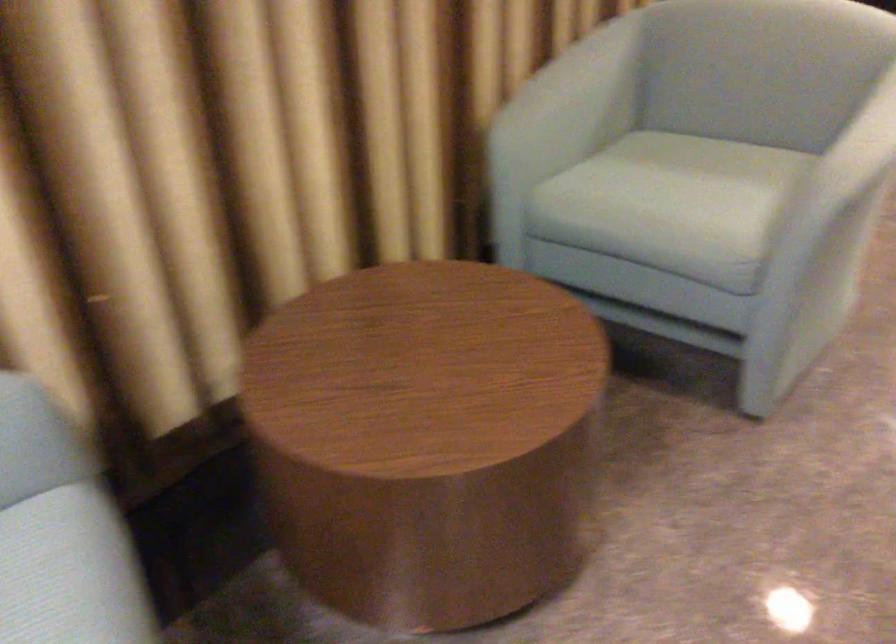
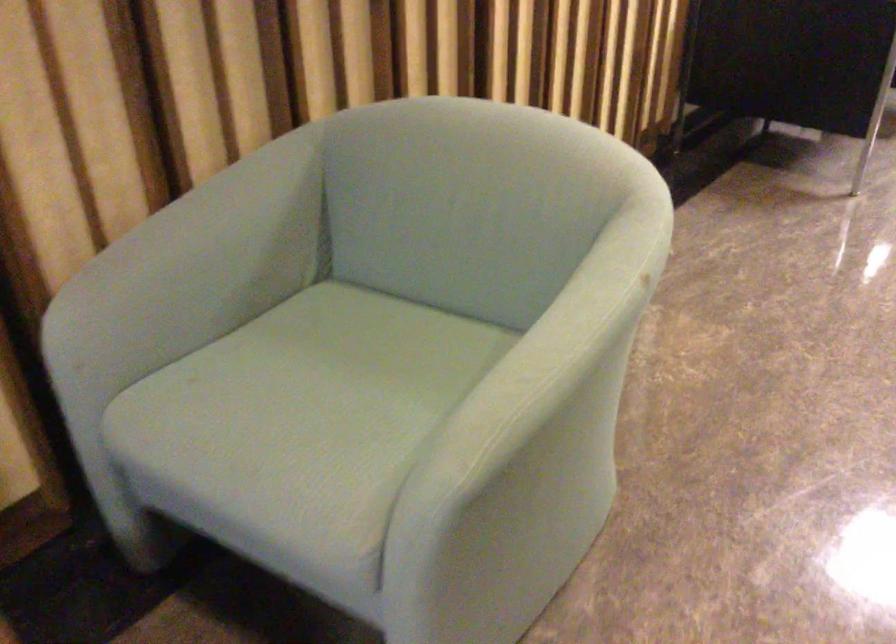
In a continuous first-person perspective shot, in which direction is the camera moving?

The cameraman walked toward right, forward.